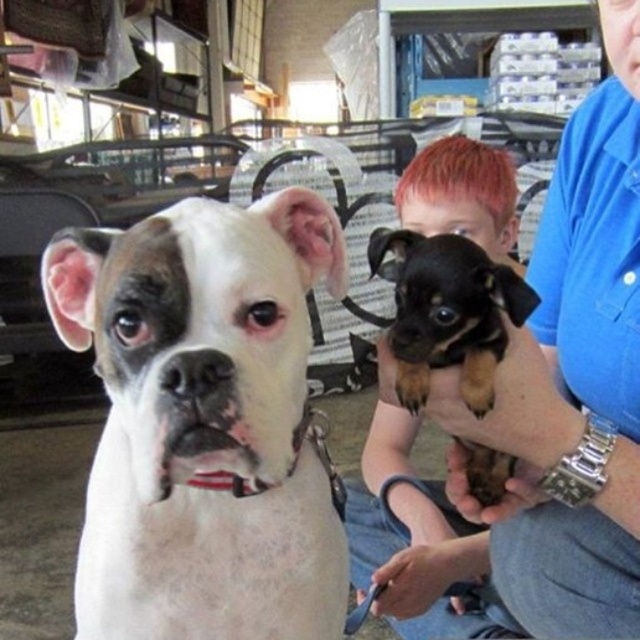
Based on the scene description, can you determine which dog is taller between the white fur dog at left and the smooth black fur at center?

The white fur dog at left is not as tall as smooth black fur at center, so the smooth black fur at center is taller.

You are standing in front of the white fur dog at left in the pet store. You want to pet the dog but need to know if you can reach it without moving closer. The average human arm length is about 28 inches. Can you comfortably reach the dog?

The distance between you and the white fur dog at left is 17.28 inches, which is less than the average human arm length of 28 inches. Therefore, you can comfortably reach the dog without needing to move closer.